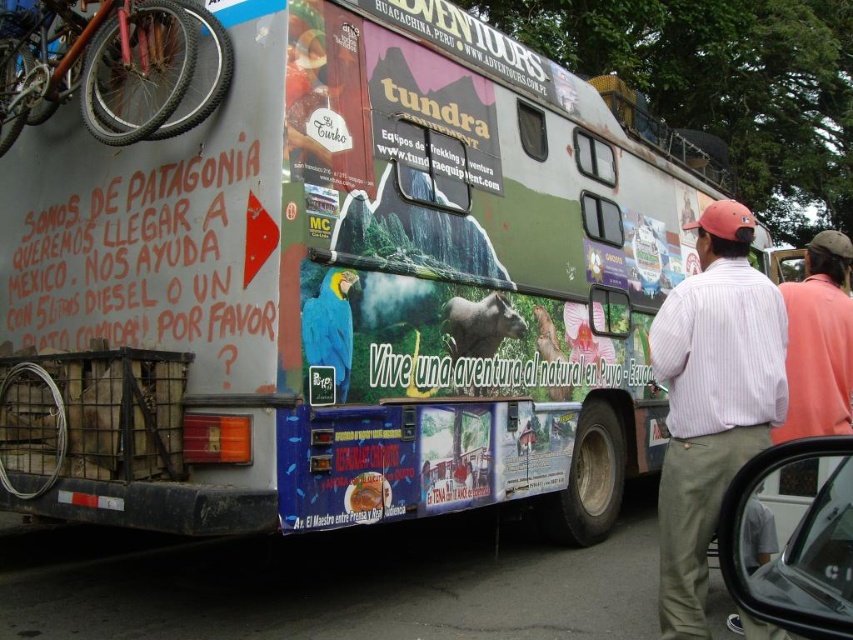
Is point (776, 314) behind point (135, 120)?

No.

Does point (738, 448) come farther from viewer compared to point (138, 49)?

That is False.

Identify the location of striped cotton shirt at right. (711, 400).